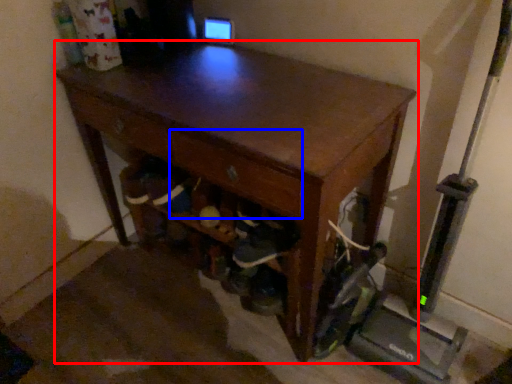
Question: Which object appears farthest to the camera in this image, desk (highlighted by a red box) or drawer (highlighted by a blue box)?

Choices:
 (A) desk
 (B) drawer

Answer: (B)